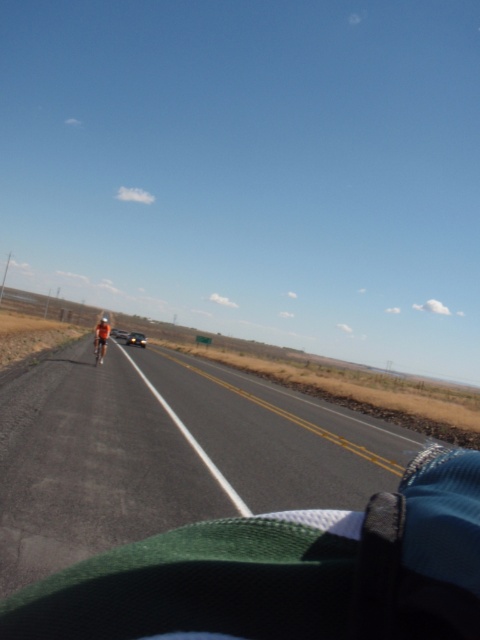
You are a pedestrian standing on the side of the road and want to cross to the other side. There is an asphalt road at center and an orange fabric bicycle at center. Which direction should you look first before crossing?

The asphalt road at center is positioned on the right side of orange fabric bicycle at center, so you should look to the right first before crossing.

You are a pedestrian standing at the side of the rural road. You see an orange fabric bicycle at center and a metallic silver car at center. Which one is closer to you?

The orange fabric bicycle at center is closer to you because it has a smaller size compared to the metallic silver car at center.

You are standing at the point marked as point (311,426) on the map. A drone is flying towards you at a constant speed of 5 meters per second. How many seconds will it take for the drone to reach you?

The point (311,426) is 12.35 meters away from the viewer. Since the drone is flying towards you at 5 meters per second, it will take approximately 2.47 seconds to reach you.